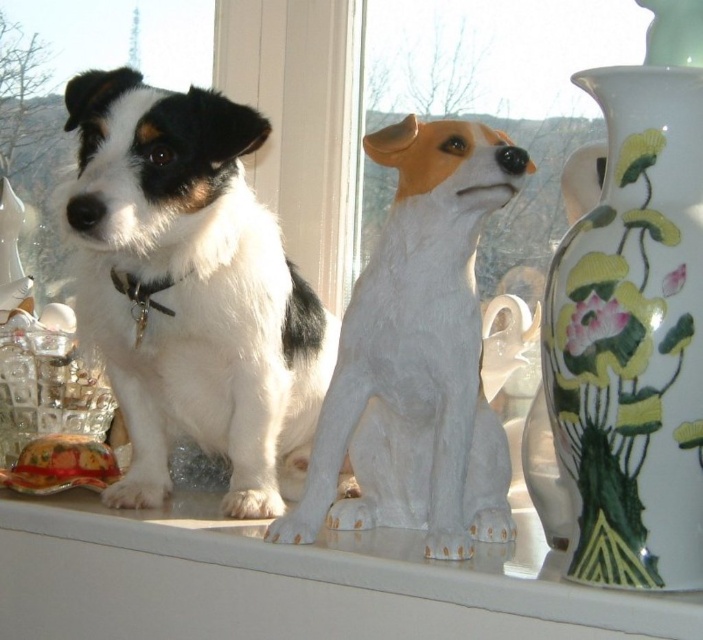
From the picture: Is white glossy statue at center positioned behind white glossy window sill at center?

Yes, it is.

Which is in front, point (363, 344) or point (236, 545)?

Point (363, 344) is more forward.

Locate an element on the screen. This screenshot has height=640, width=703. white glossy statue at center is located at coordinates (418, 355).

Between point (83, 74) and point (225, 572), which one is positioned behind?

Point (83, 74)

Where is `black and white fur dog at center`? black and white fur dog at center is located at coordinates (191, 291).

Where is `black and white fur dog at center`? Image resolution: width=703 pixels, height=640 pixels. black and white fur dog at center is located at coordinates (191, 291).

Who is more forward, (638, 84) or (456, 164)?

Point (638, 84)

Describe the element at coordinates (632, 339) in the screenshot. I see `porcelain vase with floral design at right` at that location.

Find the location of a particular element. porcelain vase with floral design at right is located at coordinates (632, 339).